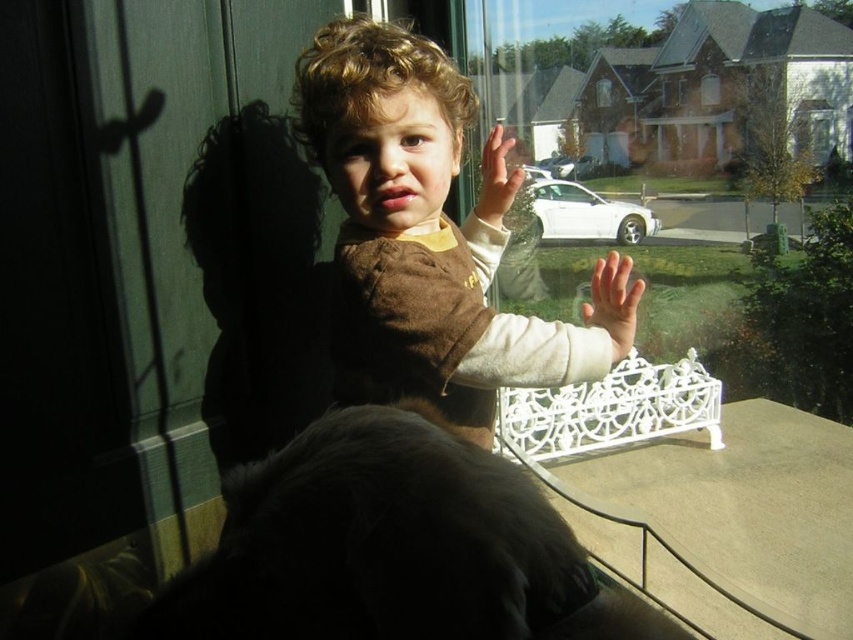
Which is behind, point (438, 200) or point (490, 156)?

Positioned behind is point (490, 156).

Identify the location of brown fuzzy sweater at center. The height and width of the screenshot is (640, 853). (416, 236).

I want to click on brown fuzzy sweater at center, so click(x=416, y=236).

Does brown fuzzy sweater at center lie in front of smooth skin hand at center?

No, brown fuzzy sweater at center is behind smooth skin hand at center.

Who is shorter, brown fuzzy sweater at center or smooth skin hand at center?

Standing shorter between the two is smooth skin hand at center.

Is point (430, 307) less distant than point (619, 340)?

Yes.

Image resolution: width=853 pixels, height=640 pixels. In order to click on brown fuzzy sweater at center in this screenshot , I will do `click(416, 236)`.

Can you confirm if smooth skin hand at center is shorter than smooth skin hand at upper center?

Yes, smooth skin hand at center is shorter than smooth skin hand at upper center.

Does smooth skin hand at center have a greater height compared to smooth skin hand at upper center?

Incorrect, smooth skin hand at center's height is not larger of smooth skin hand at upper center's.

The image size is (853, 640). Find the location of `smooth skin hand at center`. smooth skin hand at center is located at coordinates (614, 301).

Where is `smooth skin hand at center`? This screenshot has width=853, height=640. smooth skin hand at center is located at coordinates (614, 301).